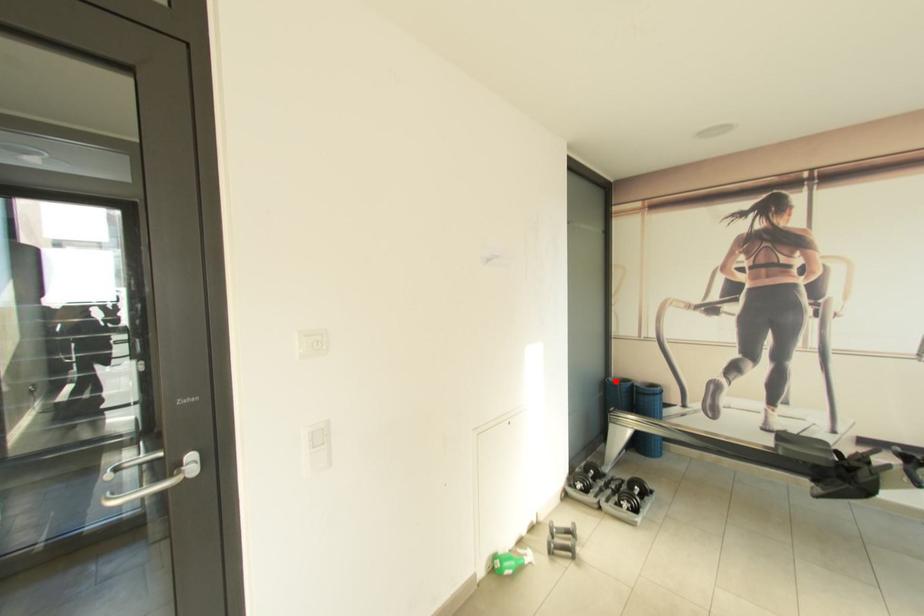
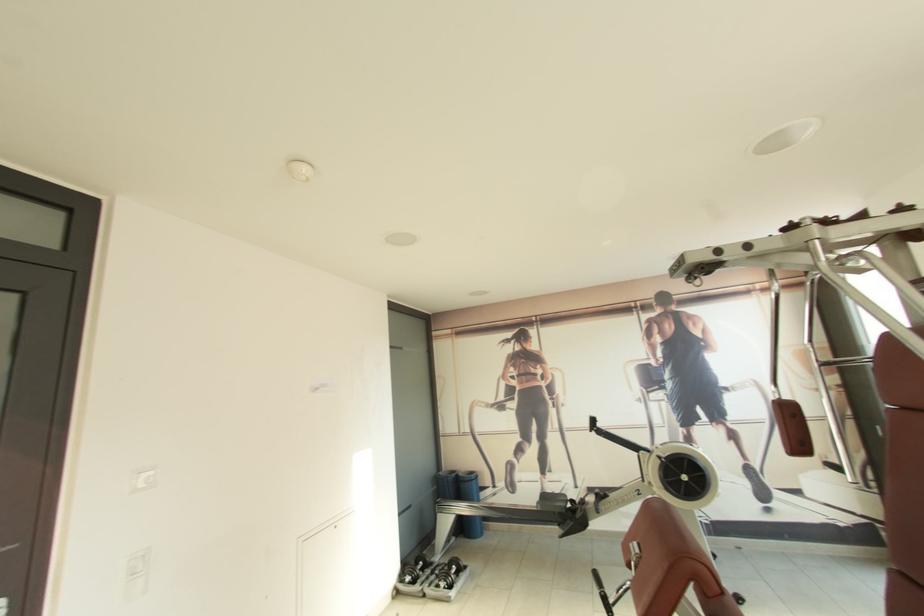
Question: I am providing you with two images of the same scene from different viewpoints. Given a red point in image1, look at the same physical point in image2. Is it:

Choices:
 (A) Closer to the viewpoint
 (B) Farther from the viewpoint

Answer: (B)